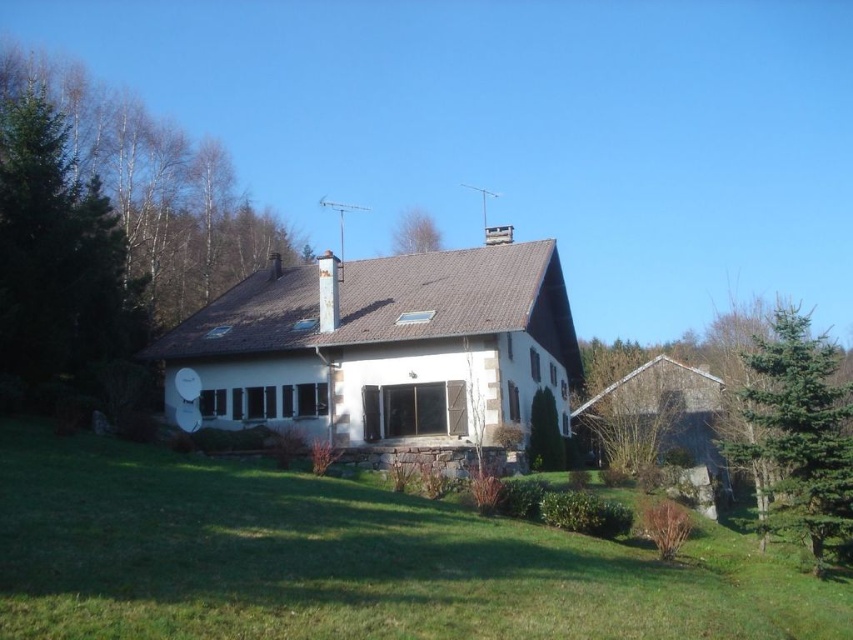
Can you confirm if green grass at lower center is positioned above green coniferous tree at right?

No, green grass at lower center is not above green coniferous tree at right.

Between green grass at lower center and green coniferous tree at right, which one appears on the right side from the viewer's perspective?

From the viewer's perspective, green coniferous tree at right appears more on the right side.

The image size is (853, 640). What do you see at coordinates (346, 561) in the screenshot? I see `green grass at lower center` at bounding box center [346, 561].

Locate an element on the screen. The height and width of the screenshot is (640, 853). green grass at lower center is located at coordinates (346, 561).

Is point (740, 452) less distant than point (409, 220)?

Yes.

Is point (761, 396) positioned before point (407, 218)?

Yes, it is in front of point (407, 218).

What are the coordinates of `green coniferous tree at right` in the screenshot? It's located at (799, 435).

Does green leafy tree at left appear over green coniferous tree at right?

Yes.

Does point (175, 132) lie in front of point (831, 464)?

That is False.

The width and height of the screenshot is (853, 640). Identify the location of green leafy tree at left. (146, 204).